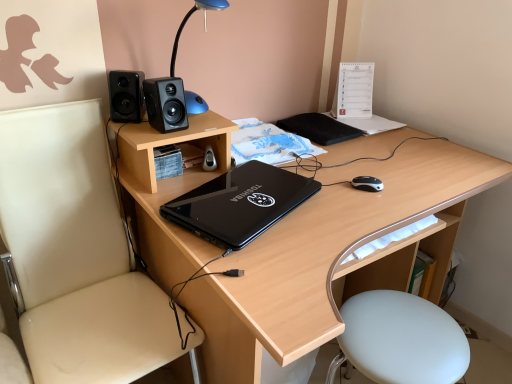
The image size is (512, 384). I want to click on vacant space to the right of black matte speaker at upper center, arranged as the 2th speaker when viewed from the left, so click(208, 125).